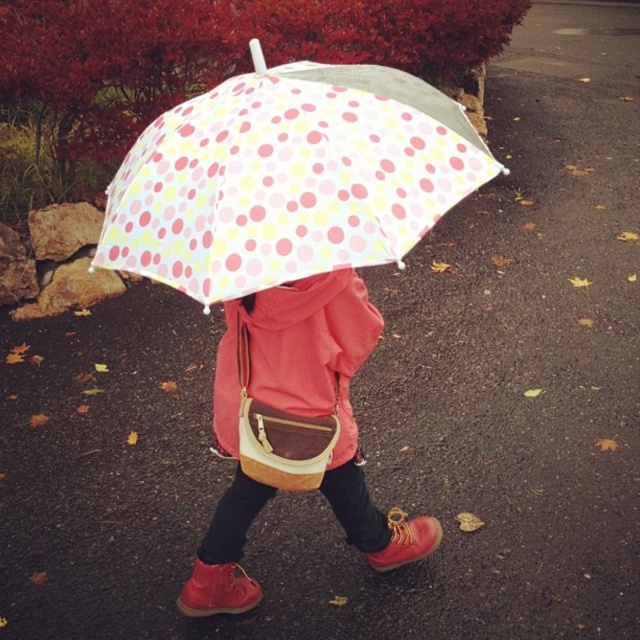
Question: Is polka dot fabric umbrella at center further to camera compared to matte yellow crossbody bag at center?

Choices:
 (A) yes
 (B) no

Answer: (B)

Question: Among these objects, which one is nearest to the camera?

Choices:
 (A) polka dot fabric umbrella at center
 (B) matte pink jacket at center

Answer: (A)

Question: Is polka dot fabric umbrella at center wider than matte yellow crossbody bag at center?

Choices:
 (A) yes
 (B) no

Answer: (A)

Question: Which point is farther to the camera?

Choices:
 (A) polka dot fabric umbrella at center
 (B) matte yellow crossbody bag at center

Answer: (B)

Question: Which of the following is the farthest from the observer?

Choices:
 (A) (355, 429)
 (B) (353, 364)
 (C) (218, 173)

Answer: (A)

Question: Can you confirm if polka dot fabric umbrella at center is wider than matte pink jacket at center?

Choices:
 (A) yes
 (B) no

Answer: (A)